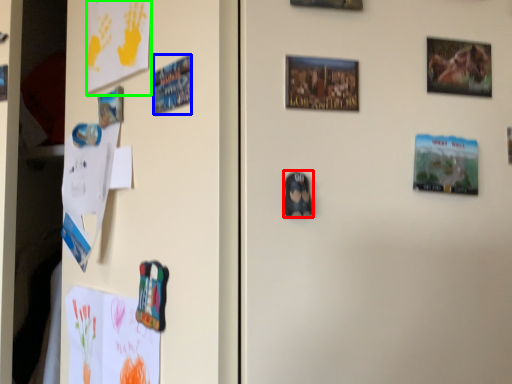
Question: Which object is positioned farthest from print (highlighted by a red box)? Select from print (highlighted by a blue box) and postcard (highlighted by a green box).

Choices:
 (A) print
 (B) postcard

Answer: (B)